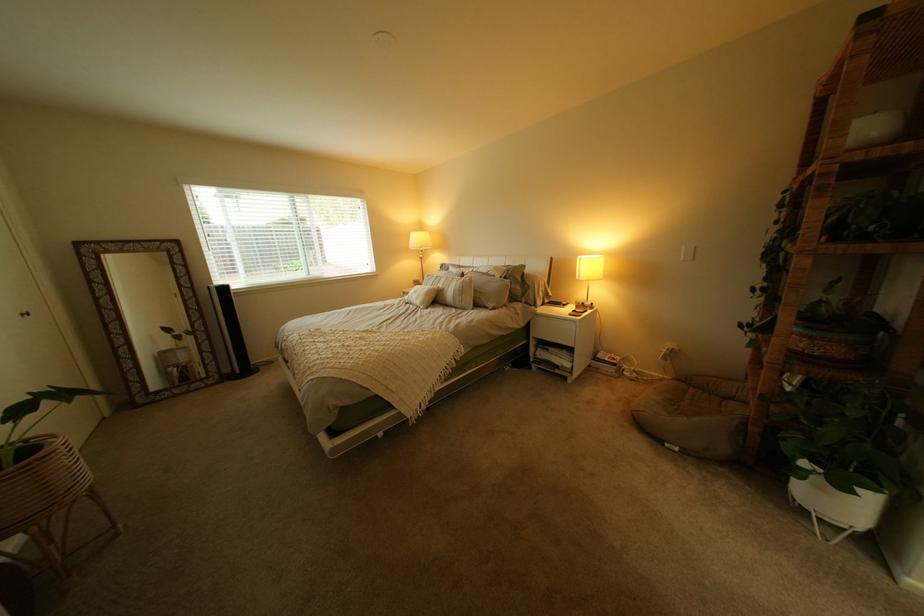
Which object does [841,336] point to?

It refers to a patterned flower pot.